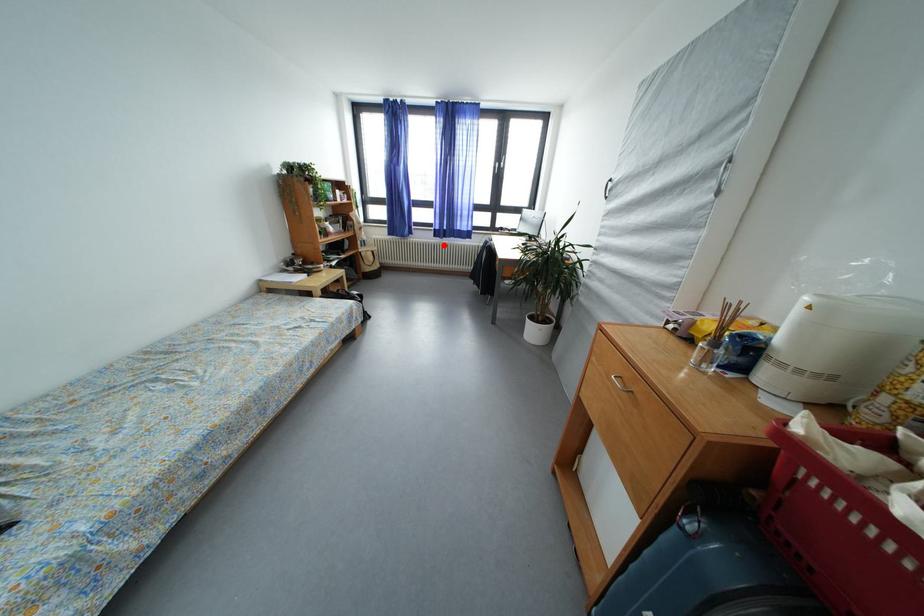
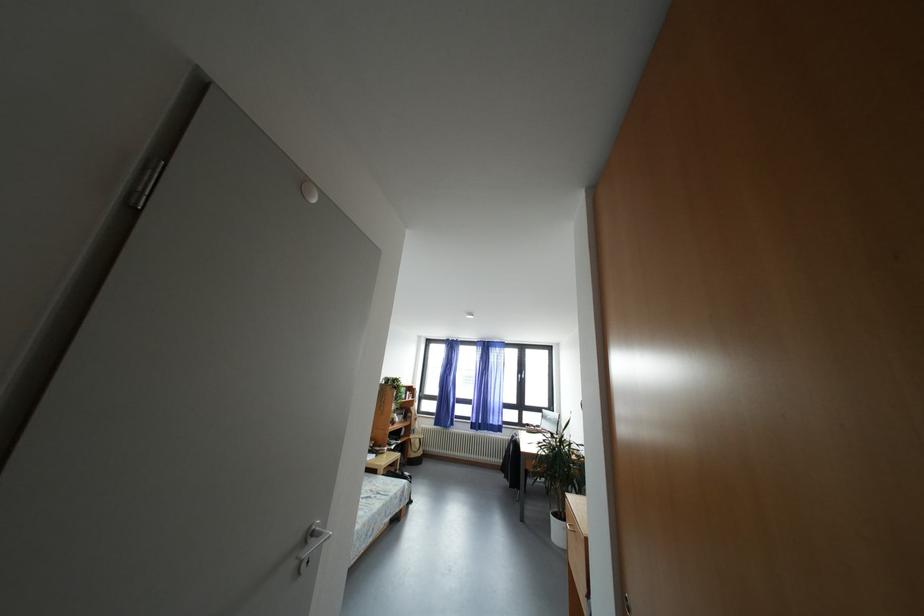
Question: A red point is marked in image1. In image2, is the corresponding 3D point closer to the camera or farther? Reply with the corresponding letter.

Choices:
 (A) The corresponding 3D point is closer.
 (B) The corresponding 3D point is farther.

Answer: (B)